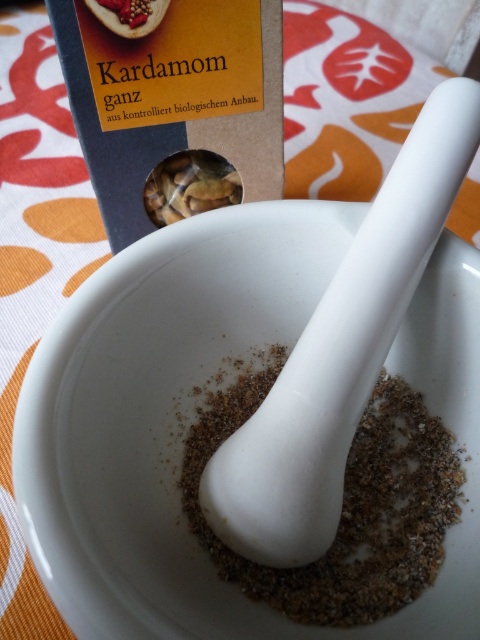
Who is lower down, white matte mortar and pestle at center or brown matte cardamom at upper left?

white matte mortar and pestle at center is lower down.

The width and height of the screenshot is (480, 640). What do you see at coordinates (344, 504) in the screenshot? I see `white matte mortar and pestle at center` at bounding box center [344, 504].

Who is more distant from viewer, (239,376) or (129,1)?

The point (239,376) is behind.

Image resolution: width=480 pixels, height=640 pixels. What are the coordinates of `white matte mortar and pestle at center` in the screenshot? It's located at [344, 504].

Is white matte mortar and pestle at center wider than brown matte almonds at center?

Yes, white matte mortar and pestle at center is wider than brown matte almonds at center.

Who is more forward, (425, 568) or (239, 180)?

Point (425, 568) is in front.

Between point (414, 490) and point (175, 184), which one is positioned behind?

The point (175, 184) is behind.

Find the location of a particular element. Image resolution: width=480 pixels, height=640 pixels. white matte mortar and pestle at center is located at coordinates (344, 504).

Consider the image. Who is taller, brown matte almonds at center or brown matte cardamom at upper left?

Standing taller between the two is brown matte almonds at center.

Does brown matte almonds at center appear under brown matte cardamom at upper left?

Indeed, brown matte almonds at center is positioned under brown matte cardamom at upper left.

Who is more distant from viewer, (156, 196) or (119, 17)?

The point (156, 196) is behind.

This screenshot has height=640, width=480. What are the coordinates of `brown matte almonds at center` in the screenshot? It's located at (190, 186).